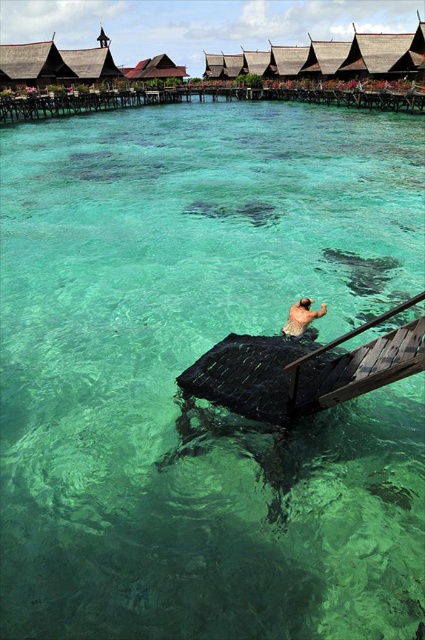
Consider the image. Measure the distance between wooden dock at upper center and camera.

They are 214.67 feet apart.

Locate an element on the screen. The height and width of the screenshot is (640, 425). wooden dock at upper center is located at coordinates (198, 100).